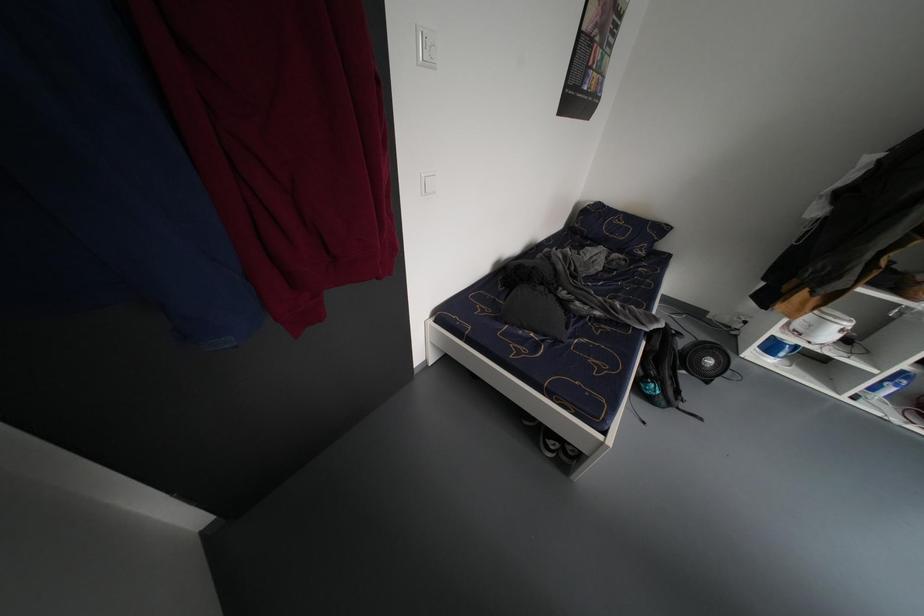
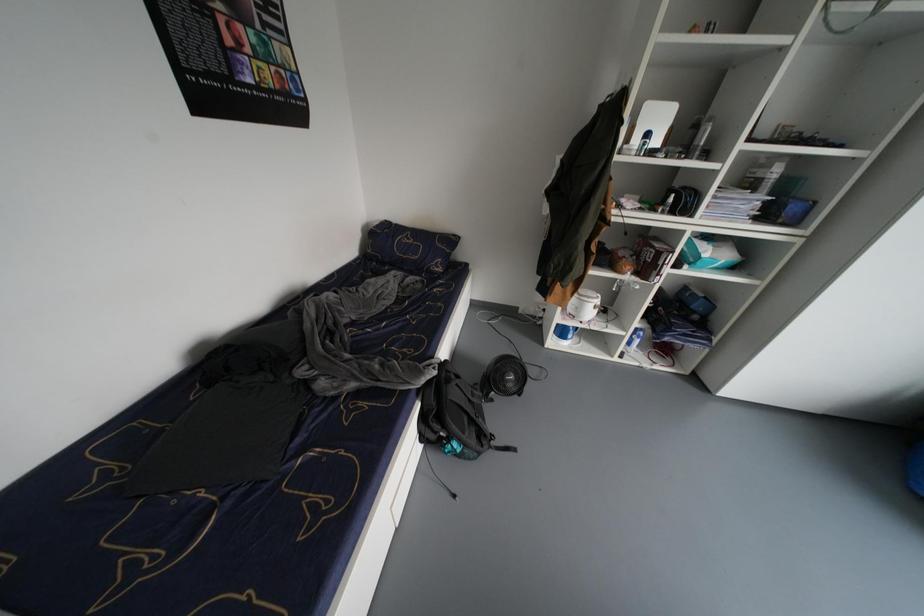
Question: The images are taken continuously from a first-person perspective. In which direction is your viewpoint rotating?

Choices:
 (A) Left
 (B) Right
 (C) Up
 (D) Down

Answer: (B)